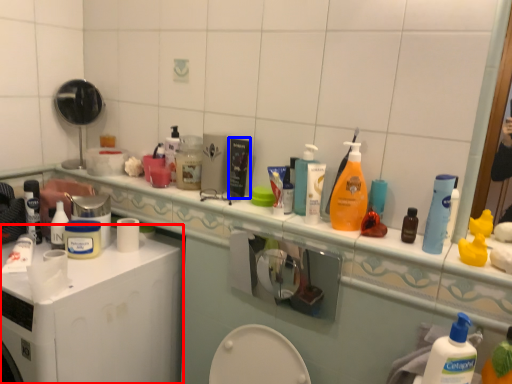
Question: Which of the following is the farthest to the observer, washing machine (highlighted by a red box) or product (highlighted by a blue box)?

Choices:
 (A) washing machine
 (B) product

Answer: (B)